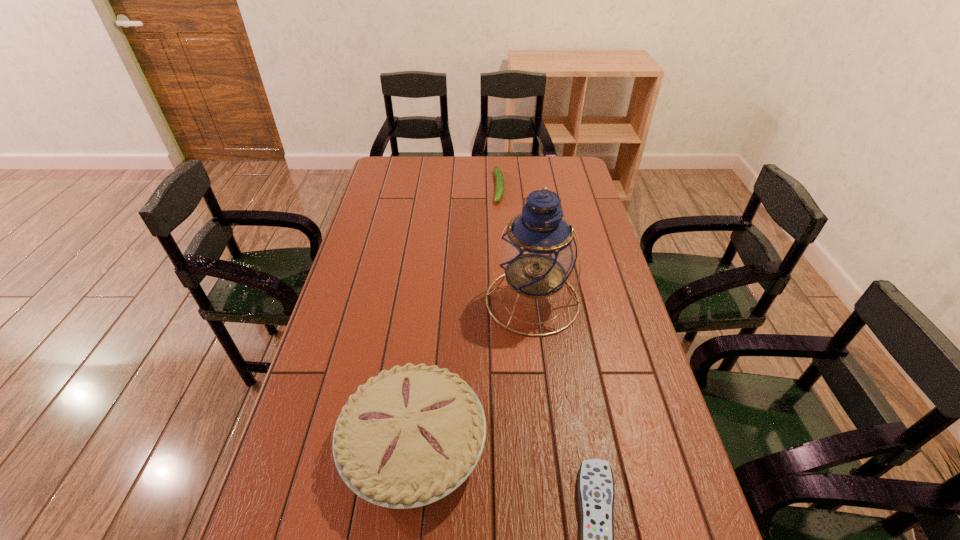
I want to click on the third shortest object, so click(410, 436).

The width and height of the screenshot is (960, 540). Identify the location of the leftmost object. (410, 436).

Find the location of a particular element. The image size is (960, 540). lantern is located at coordinates (538, 252).

You are a GUI agent. You are given a task and a screenshot of the screen. Output one action in this format:
    pyautogui.click(x=<x>, y=<y>)
    Task: Click on the tallest object
    This screenshot has width=960, height=540.
    Given the screenshot: What is the action you would take?
    pyautogui.click(x=538, y=252)

Where is `the farthest object`? Image resolution: width=960 pixels, height=540 pixels. the farthest object is located at coordinates (498, 173).

Image resolution: width=960 pixels, height=540 pixels. In order to click on the second shortest object in this screenshot , I will do `click(498, 173)`.

At what (x,y) coordinates should I click in order to perform the action: click on vacant space positioned on the right of the pie. Please return your answer as a coordinate pair (x, y). Looking at the image, I should click on (537, 444).

Find the location of `vacant space situated 0.330m on the front-facing side of the tallest object`. vacant space situated 0.330m on the front-facing side of the tallest object is located at coordinates (527, 444).

The height and width of the screenshot is (540, 960). What are the coordinates of `free space located on the front-facing side of the tallest object` in the screenshot? It's located at (527, 453).

Find the location of a particular element. vacant point located 0.160m on the front-facing side of the tallest object is located at coordinates (529, 383).